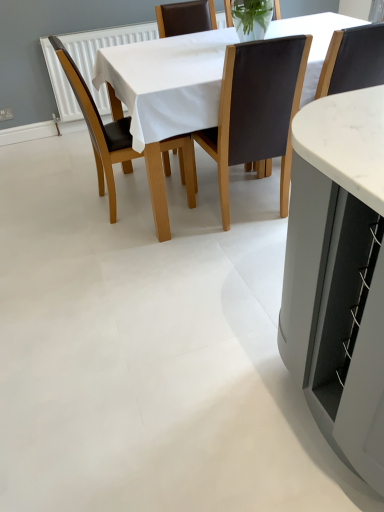
Question: In terms of size, does brown leather chair at center, arranged as the 3th chair when viewed from the right, appear bigger or smaller than brown leather chair at center, acting as the second chair starting from the right?

Choices:
 (A) big
 (B) small

Answer: (A)

Question: From their relative heights in the image, would you say brown leather chair at center, arranged as the 1th chair when viewed from the left, is taller or shorter than brown leather chair at center, acting as the second chair starting from the right?

Choices:
 (A) short
 (B) tall

Answer: (A)

Question: Estimate the real-world distances between objects in this image. Which object is closer to the white fabric table at center?

Choices:
 (A) brown leather chair at center, positioned as the second chair in left-to-right order
 (B) brown leather chair at center, arranged as the 3th chair when viewed from the right
 (C) black leather chair at center, acting as the 1th chair starting from the right

Answer: (B)

Question: Which is nearer to the brown leather chair at center, acting as the second chair starting from the right?

Choices:
 (A) white fabric table at center
 (B) black leather chair at center, acting as the 1th chair starting from the right
 (C) brown leather chair at center, arranged as the 3th chair when viewed from the right

Answer: (B)